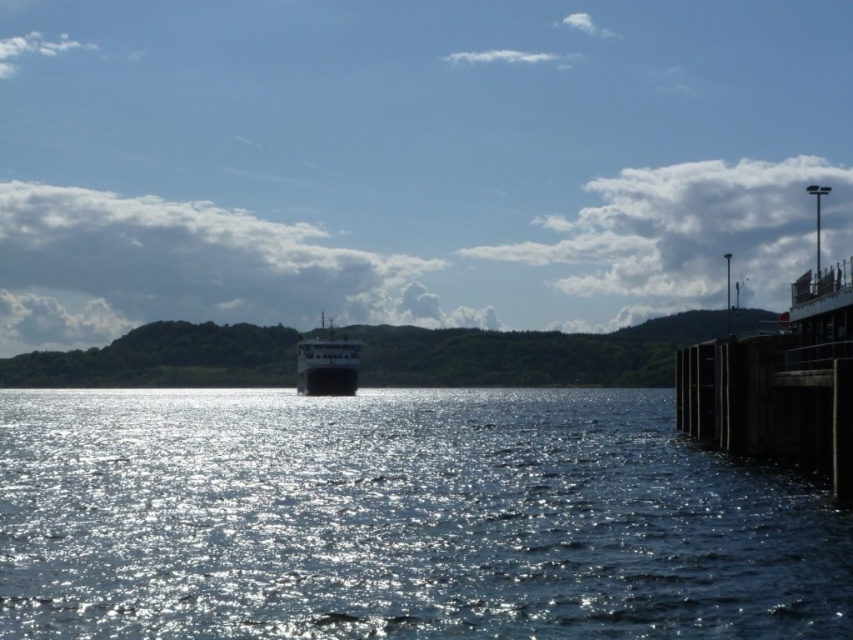
Who is higher up, shiny reflective water at center or shiny black ship at center?

shiny black ship at center is above.

Who is lower down, shiny reflective water at center or shiny black ship at center?

shiny reflective water at center

I want to click on shiny reflective water at center, so (x=399, y=518).

Where is `shiny reflective water at center`? Image resolution: width=853 pixels, height=640 pixels. shiny reflective water at center is located at coordinates (399, 518).